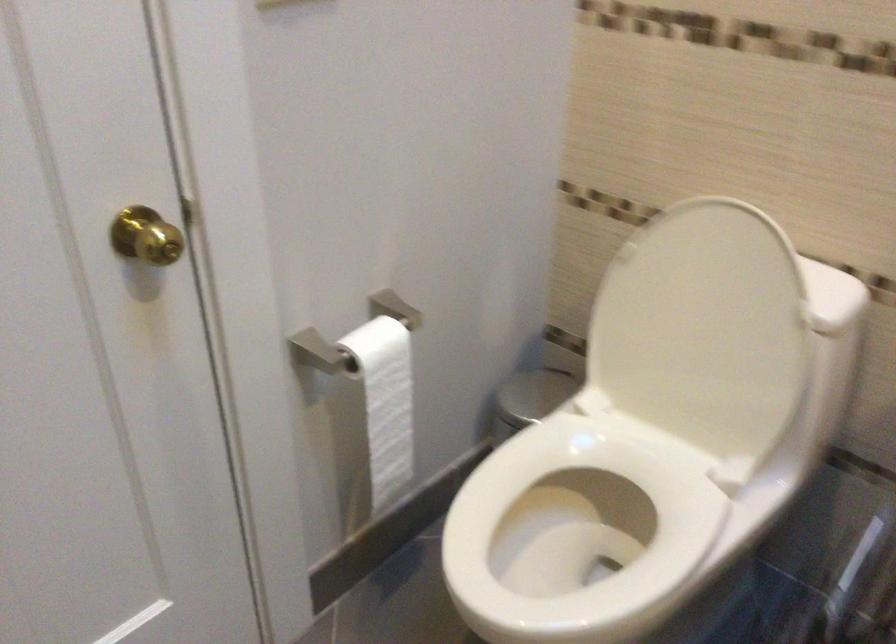
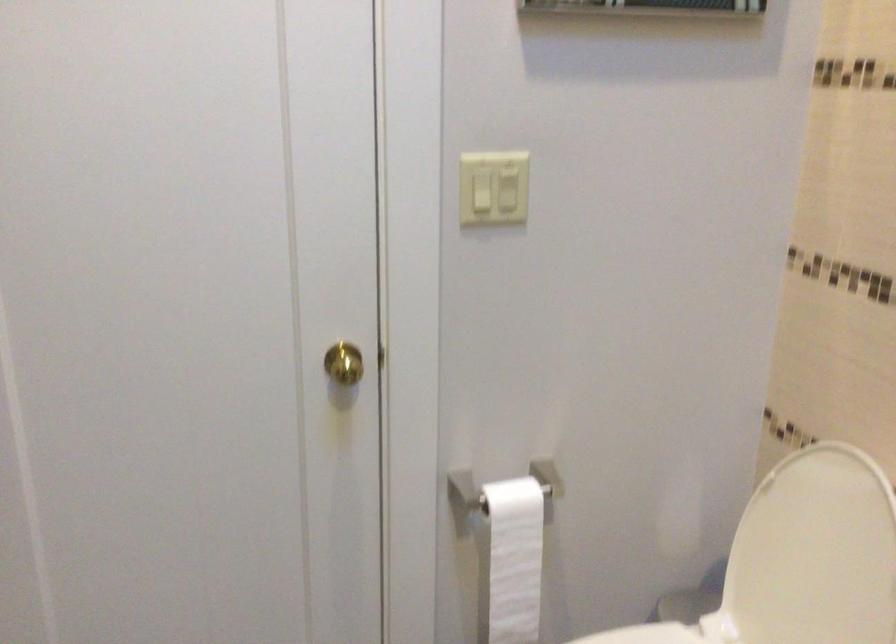
Locate, in the second image, the point that corresponds to the point at 389,408 in the first image.

(513, 560)